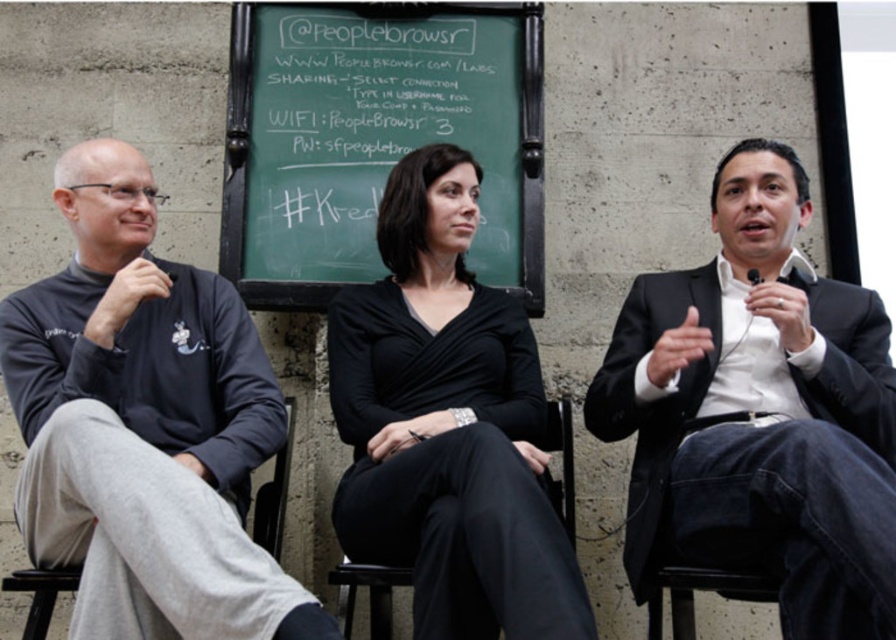
Question: Can you confirm if dark gray sweatshirt at left is smaller than black matte dress at center?

Choices:
 (A) no
 (B) yes

Answer: (A)

Question: Which point is farther to the camera?

Choices:
 (A) (250, 620)
 (B) (756, 275)

Answer: (B)

Question: Is dark gray sweatshirt at left bigger than green chalkboard at center?

Choices:
 (A) no
 (B) yes

Answer: (B)

Question: Among these objects, which one is farthest from the camera?

Choices:
 (A) gray fabric chair at left
 (B) black matte dress at center
 (C) black suit at center
 (D) black matte microphone at right

Answer: (D)

Question: Estimate the real-world distances between objects in this image. Which object is closer to the dark gray sweatshirt at left?

Choices:
 (A) gray fabric chair at left
 (B) black matte microphone at right
 (C) black leather chair at center

Answer: (A)

Question: Is green chalkboard at center to the left of gray fabric chair at left from the viewer's perspective?

Choices:
 (A) no
 (B) yes

Answer: (B)